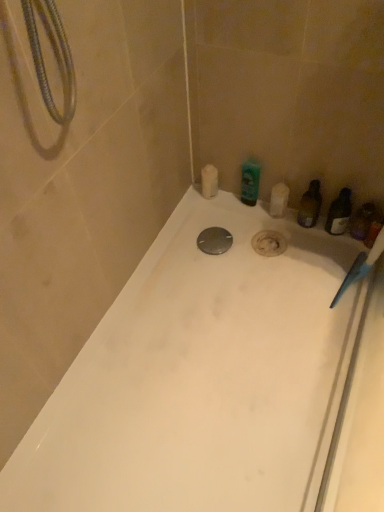
In order to click on free location in front of translucent plastic bottle at right, marked as the second toiletry in a right-to-left arrangement in this screenshot , I will do `click(314, 264)`.